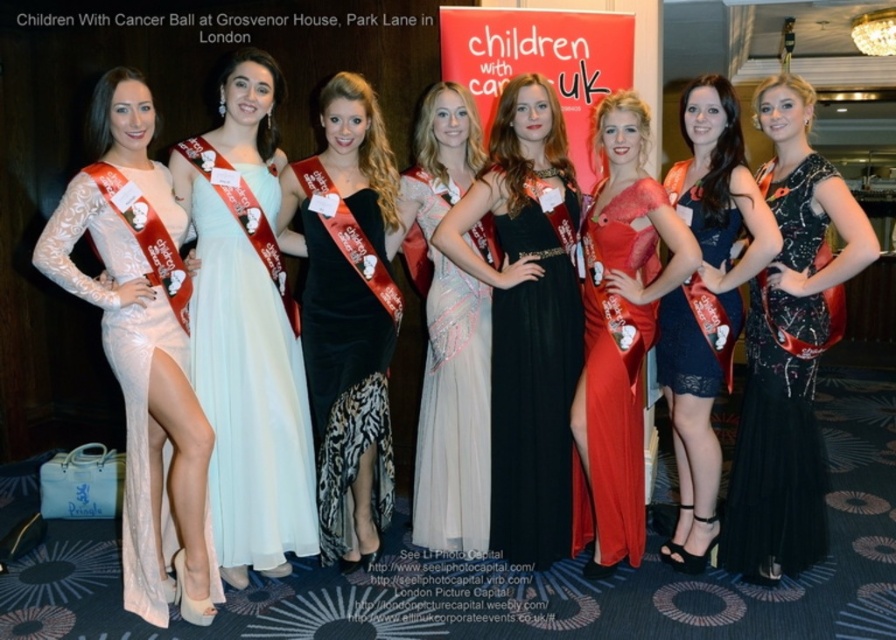
You are attending the Children With Cancer Ball and need to locate the pearl lace dress at left and the black satin dress at center. Based on their positions, which dress is closer to the stage if the stage is at the top of the image?

The pearl lace dress at left is below the black satin dress at center, so the black satin dress at center is closer to the stage located at the top of the image.